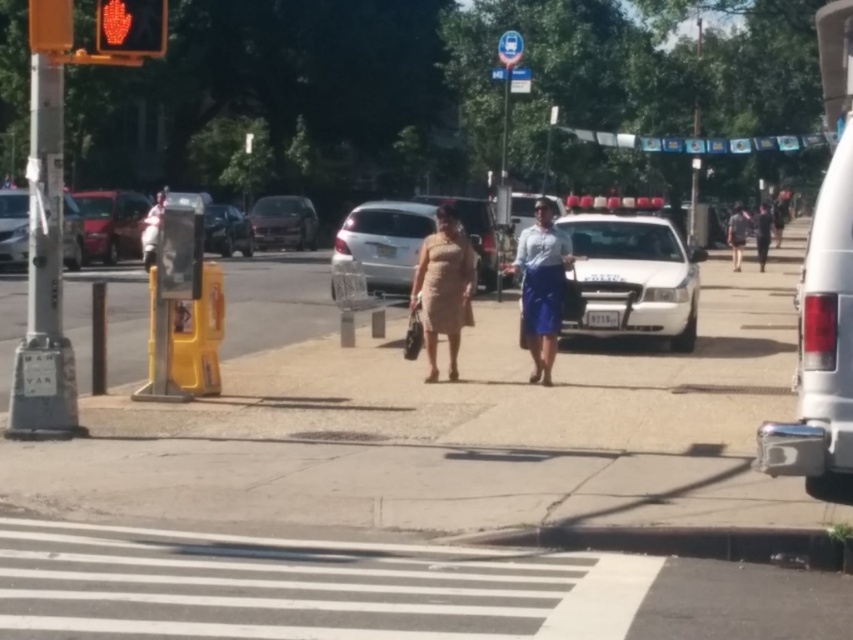
Is point (666, 484) positioned before point (113, 1)?

Yes, it is.

Is point (74, 440) positioned behind point (109, 51)?

Yes, point (74, 440) is farther from viewer.

The image size is (853, 640). Identify the location of gray concrete sidewalk at center. (456, 432).

Between shiny black sedan at center and dark gray fabric shirt at center, which one is positioned higher?

dark gray fabric shirt at center

Looking at this image, measure the distance from shiny black sedan at center to dark gray fabric shirt at center.

shiny black sedan at center and dark gray fabric shirt at center are 15.89 meters apart.

Measure the distance between point (233, 244) and camera.

Point (233, 244) and camera are 42.05 meters apart.

Identify the location of shiny black sedan at center. (227, 228).

Is point (633, 234) positioned before point (270, 212)?

Yes.

Who is positioned more to the left, white glossy police car at center or shiny silver sedan at center?

shiny silver sedan at center is more to the left.

Is point (596, 276) positioned after point (274, 218)?

That is False.

Locate an element on the screen. The image size is (853, 640). white glossy police car at center is located at coordinates (633, 276).